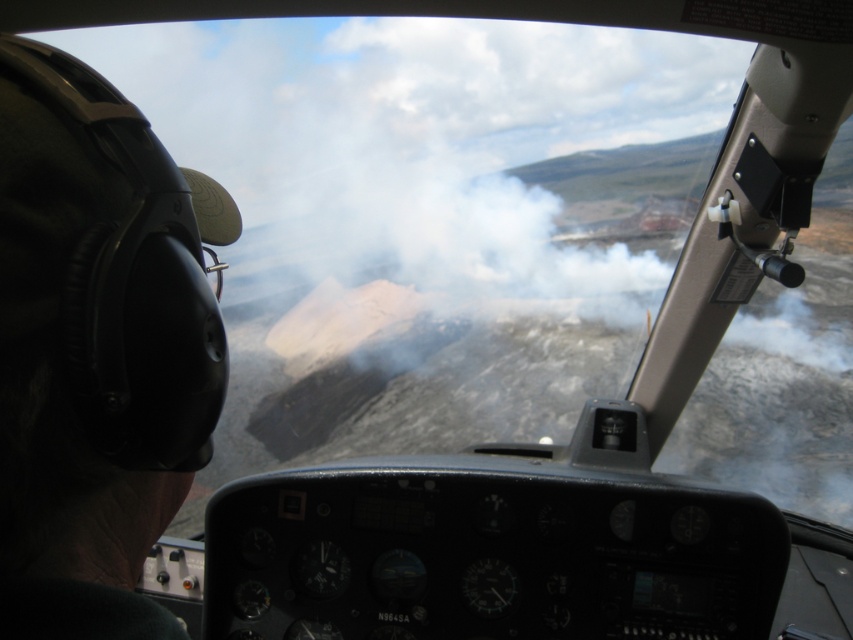
What is the object located at the coordinates point (x=96, y=348) in the image?

The object at point (x=96, y=348) is a black matte helmet at left.

You are inside the helicopter cockpit and want to reach the point marked at coordinates point (21, 308). If your arm can extend 50 centimeters, can you comfortably reach it?

The point (21, 308) is 49.22 centimeters from the viewer, so yes, you can comfortably reach it since your arm can extend 50 centimeters.

You are a pilot in a helicopter and need to determine if you can safely fly closer to the white fluffy cloud at upper center without getting too close to the black matte helmet at left. The minimum safe distance between the helicopter and any object is 50 feet. Based on the scene, can you safely approach the cloud?

The distance between the black matte helmet at left and the white fluffy cloud at upper center is 46.96 feet, which is less than the 50 feet minimum safe distance. Therefore, you cannot safely approach the cloud without violating the safety margin.